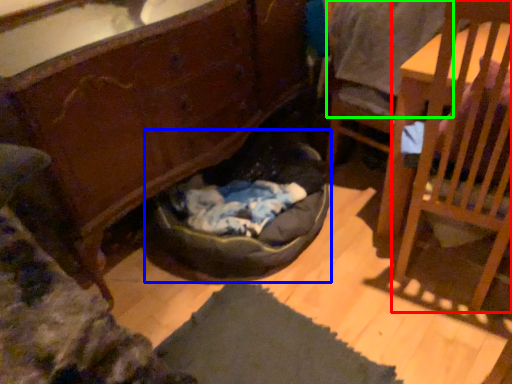
Question: Which is nearer to the chair (highlighted by a red box)? bean bag chair (highlighted by a blue box) or clothing (highlighted by a green box).

Choices:
 (A) bean bag chair
 (B) clothing

Answer: (B)